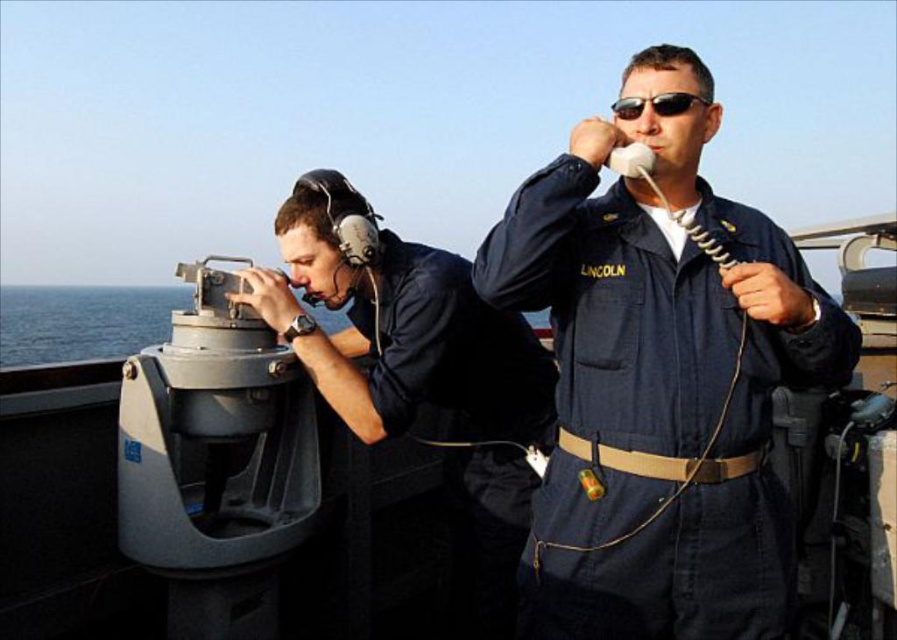
In the scene shown: Is navy blue uniform at center smaller than matte black headset at left?

Yes.

Where is `navy blue uniform at center`? The image size is (897, 640). navy blue uniform at center is located at coordinates (659, 378).

The image size is (897, 640). What do you see at coordinates (659, 378) in the screenshot?
I see `navy blue uniform at center` at bounding box center [659, 378].

Where is `navy blue uniform at center`? Image resolution: width=897 pixels, height=640 pixels. navy blue uniform at center is located at coordinates (659, 378).